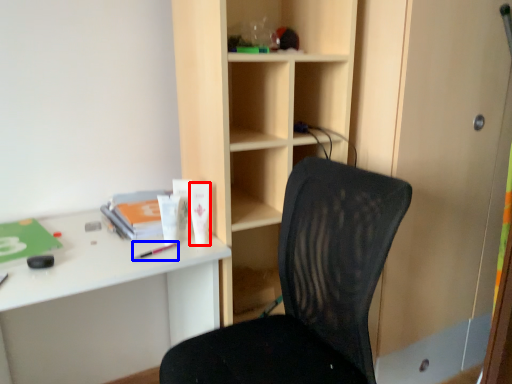
Question: Among these objects, which one is farthest to the camera, stationery (highlighted by a red box) or stationery (highlighted by a blue box)?

Choices:
 (A) stationery
 (B) stationery

Answer: (A)